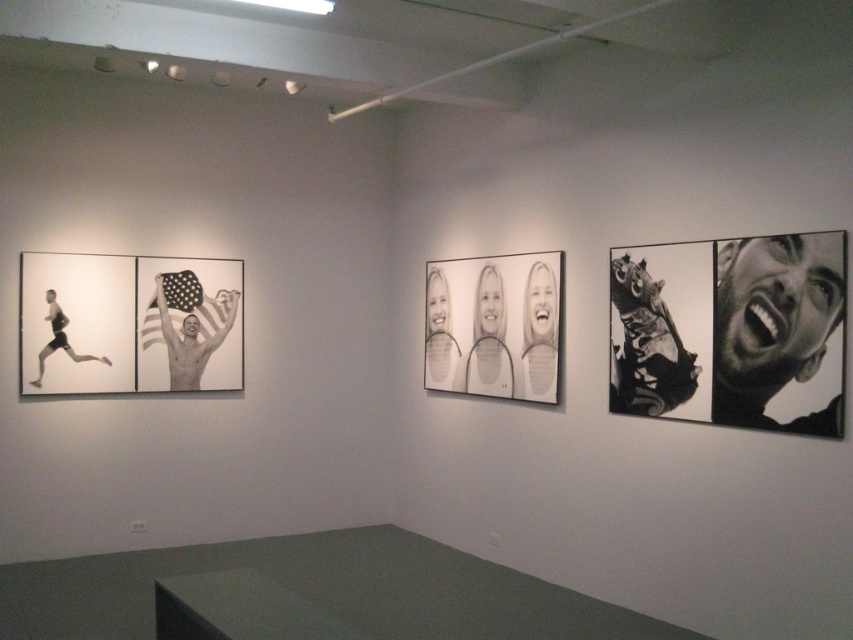
Measure the distance between point (450, 276) and camera.

A distance of 5.93 meters exists between point (450, 276) and camera.

Which of these two, black and white photograph of three smiling faces at center or white matte tennis racket at center, stands taller?

black and white photograph of three smiling faces at center

Locate an element on the screen. black and white photograph of three smiling faces at center is located at coordinates pyautogui.click(x=495, y=324).

The image size is (853, 640). Identify the location of black and white photograph of three smiling faces at center. (495, 324).

Is point (636, 394) positioned behind point (463, 381)?

That is False.

Does black glossy tattoo at upper right appear over white matte tennis racket at center?

Indeed, black glossy tattoo at upper right is positioned over white matte tennis racket at center.

Between point (631, 269) and point (476, 342), which one is positioned behind?

The point (476, 342) is behind.

The height and width of the screenshot is (640, 853). I want to click on black glossy tattoo at upper right, so click(x=646, y=346).

Can you confirm if black and white photograph of three smiling faces at center is wider than black glossy tattoo at upper right?

Yes.

Find the location of a particular element. The width and height of the screenshot is (853, 640). black and white photograph of three smiling faces at center is located at coordinates (495, 324).

Image resolution: width=853 pixels, height=640 pixels. I want to click on black and white photograph of three smiling faces at center, so click(495, 324).